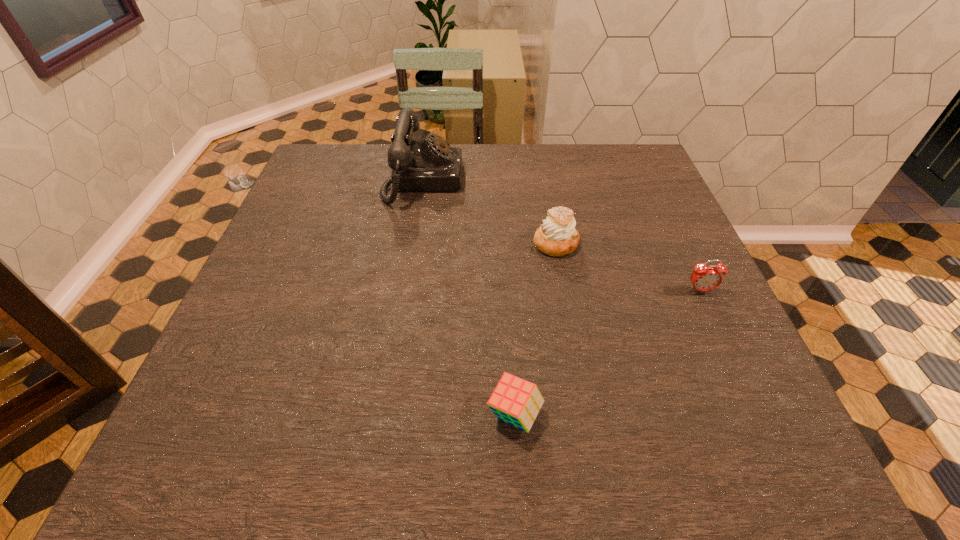
In order to click on the leftmost object in this screenshot , I will do `click(431, 164)`.

Image resolution: width=960 pixels, height=540 pixels. Find the location of `telephone`. telephone is located at coordinates (431, 164).

The height and width of the screenshot is (540, 960). I want to click on the second farthest object, so click(557, 236).

The width and height of the screenshot is (960, 540). In order to click on the second object from right to left in this screenshot , I will do `click(557, 236)`.

The width and height of the screenshot is (960, 540). What are the coordinates of `alarm clock` in the screenshot? It's located at (704, 278).

The image size is (960, 540). Find the location of `the rightmost object`. the rightmost object is located at coordinates (704, 278).

Locate an element on the screen. The image size is (960, 540). the third object from right to left is located at coordinates (515, 401).

At what (x,y) coordinates should I click in order to perform the action: click on cube. Please return your answer as a coordinate pair (x, y). Looking at the image, I should click on (515, 401).

Image resolution: width=960 pixels, height=540 pixels. I want to click on free location located 0.220m on the dial of the farthest object, so click(540, 180).

At what (x,y) coordinates should I click in order to perform the action: click on vacant space located 0.230m on the right of the third nearest object. Please return your answer as a coordinate pair (x, y). Looking at the image, I should click on (673, 244).